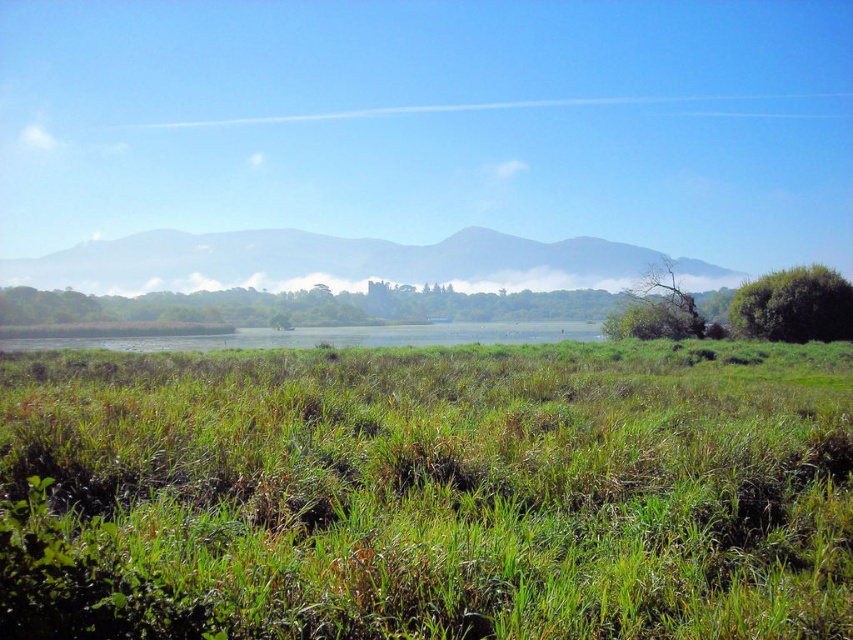
Question: Considering the relative positions of green grassy hill at center and green leafy bush at right in the image provided, where is green grassy hill at center located with respect to green leafy bush at right?

Choices:
 (A) left
 (B) right

Answer: (A)

Question: Which point appears farthest from the camera in this image?

Choices:
 (A) (265, 436)
 (B) (640, 305)

Answer: (B)

Question: Which of the following is the farthest from the observer?

Choices:
 (A) green grassy field at center
 (B) green leafy bush at right
 (C) green grassy hill at center
 (D) green leafy tree at right

Answer: (C)

Question: Does green grassy hill at center appear over green leafy bush at right?

Choices:
 (A) yes
 (B) no

Answer: (A)

Question: Which is farther from the green grassy field at center?

Choices:
 (A) green leafy tree at right
 (B) green leafy bush at right
 (C) green grassy hill at center

Answer: (C)

Question: Is green grassy hill at center further to the viewer compared to green leafy tree at right?

Choices:
 (A) no
 (B) yes

Answer: (B)